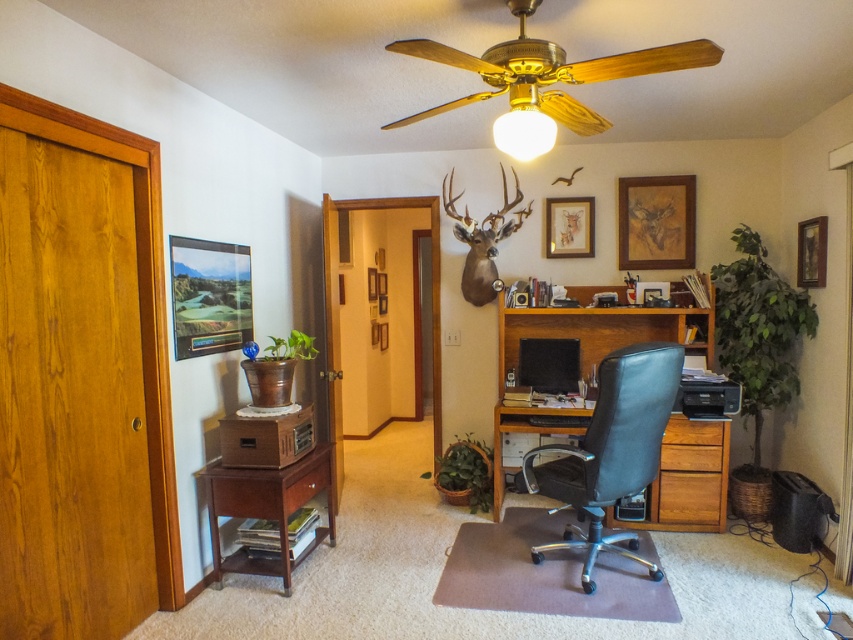
This screenshot has height=640, width=853. Describe the element at coordinates (524, 124) in the screenshot. I see `matte gold ceiling fan at upper center` at that location.

Image resolution: width=853 pixels, height=640 pixels. Identify the location of matte gold ceiling fan at upper center. (524, 124).

Who is shorter, black leather swivel chair at center or brown wood table at lower left?

brown wood table at lower left

Based on the photo, does black leather swivel chair at center come behind brown wood table at lower left?

No, black leather swivel chair at center is closer to the viewer.

The width and height of the screenshot is (853, 640). What are the coordinates of `black leather swivel chair at center` in the screenshot? It's located at (611, 451).

Is the position of woodendesk at center less distant than that of gold-framed painting at upper right?

Yes.

Does woodendesk at center appear on the right side of gold-framed painting at upper right?

Incorrect, woodendesk at center is not on the right side of gold-framed painting at upper right.

Who is more distant from viewer, (723, 435) or (653, 225)?

Positioned behind is point (653, 225).

Where is `woodendesk at center`? Image resolution: width=853 pixels, height=640 pixels. woodendesk at center is located at coordinates (596, 330).